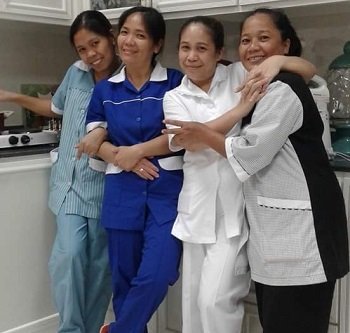
What are the coordinates of `stove top` in the screenshot? It's located at (15, 142).